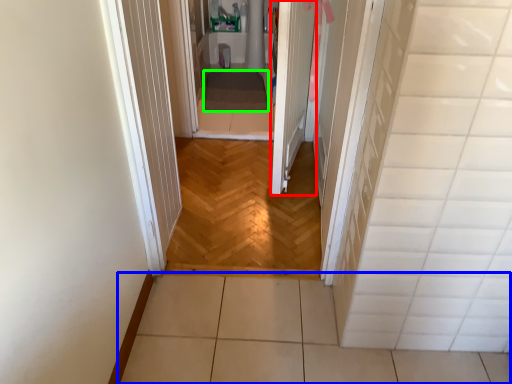
Question: Which object is positioned closest to door (highlighted by a red box)? Select from path (highlighted by a blue box) and blanket (highlighted by a green box).

Choices:
 (A) path
 (B) blanket

Answer: (B)